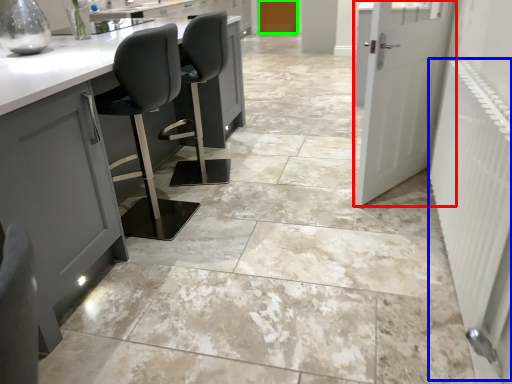
Question: Which object is the farthest from door (highlighted by a red box)? Choose among these: radiator (highlighted by a blue box) or door (highlighted by a green box).

Choices:
 (A) radiator
 (B) door

Answer: (B)